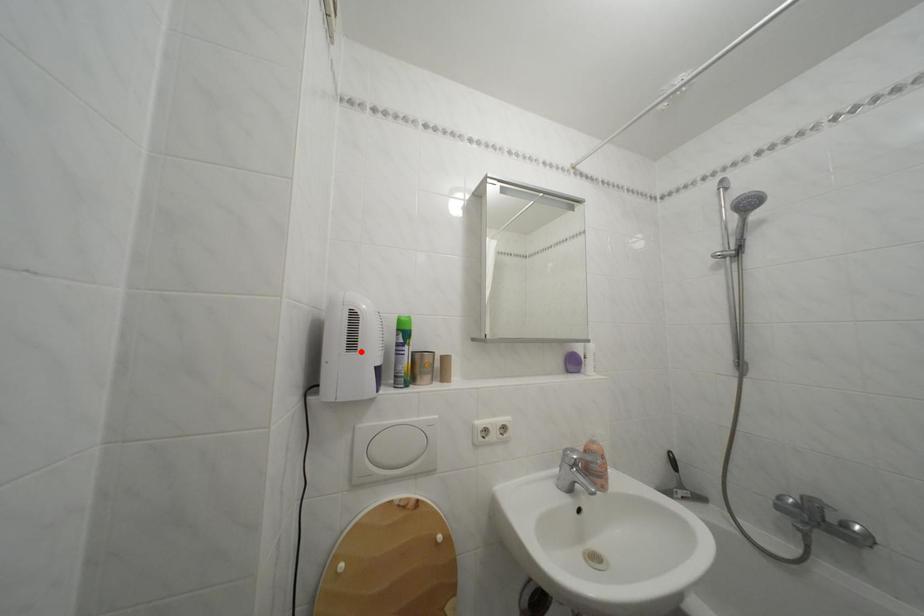
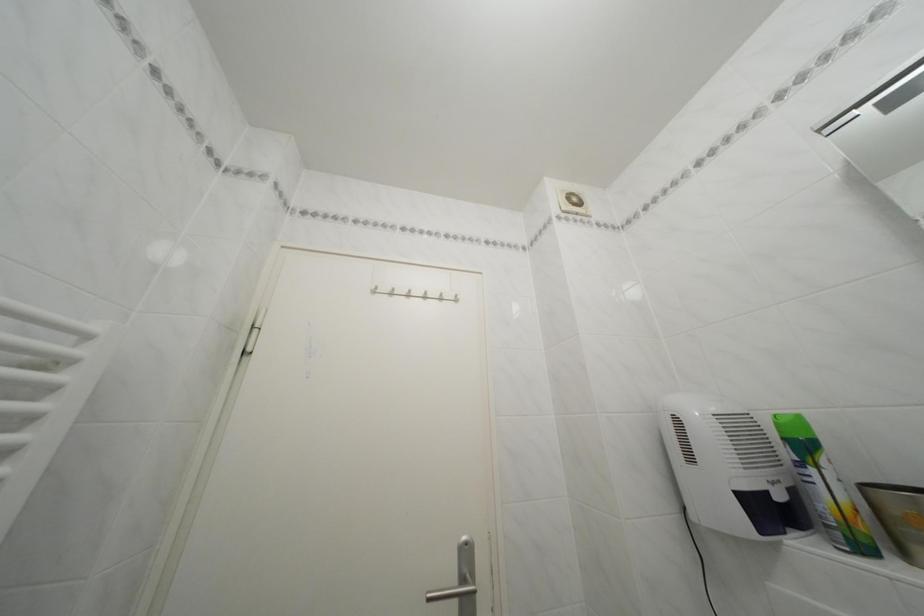
In the second image, find the point that corresponds to the highlighted location in the first image.

(699, 464)